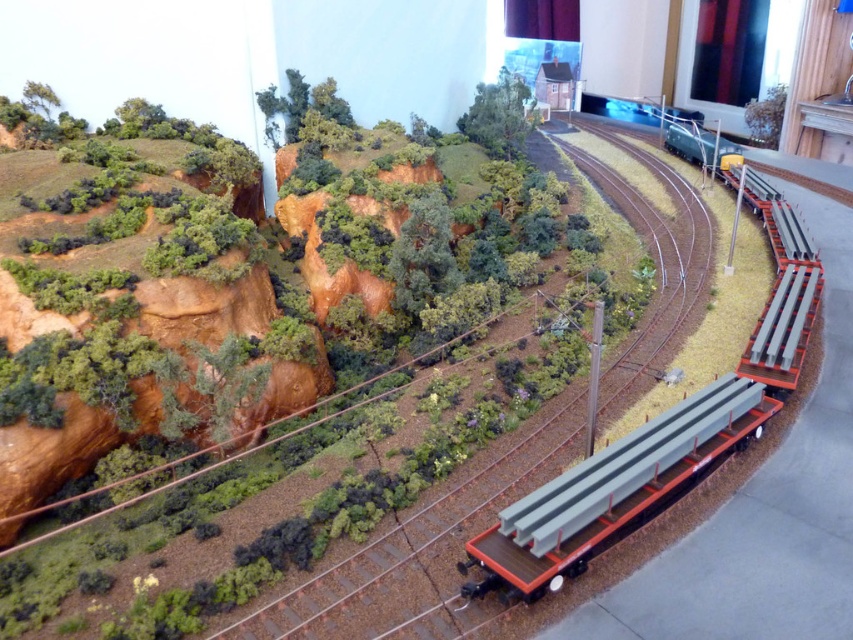
Question: Does metallic gray train track at center appear under metallic gray beams at right?

Choices:
 (A) yes
 (B) no

Answer: (A)

Question: Can you confirm if metallic gray train track at center is positioned below metallic gray beams at right?

Choices:
 (A) no
 (B) yes

Answer: (B)

Question: Among these points, which one is farthest from the camera?

Choices:
 (A) (689, 228)
 (B) (294, 608)

Answer: (A)

Question: Which point is farther to the camera?

Choices:
 (A) metallic gray beams at right
 (B) metallic gray train track at center

Answer: (A)

Question: Is metallic gray train track at center smaller than metallic gray beams at right?

Choices:
 (A) no
 (B) yes

Answer: (A)